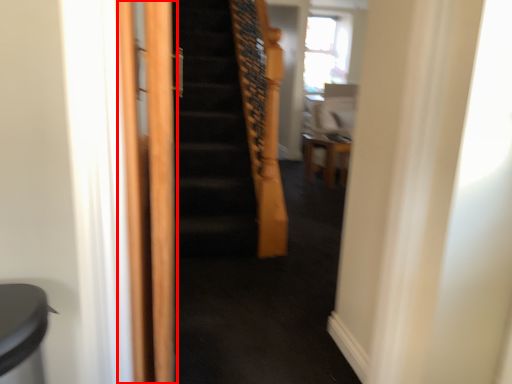
Question: From the image's perspective, what is the correct spatial positioning of screen door (annotated by the red box) in reference to furniture?

Choices:
 (A) above
 (B) below

Answer: (B)